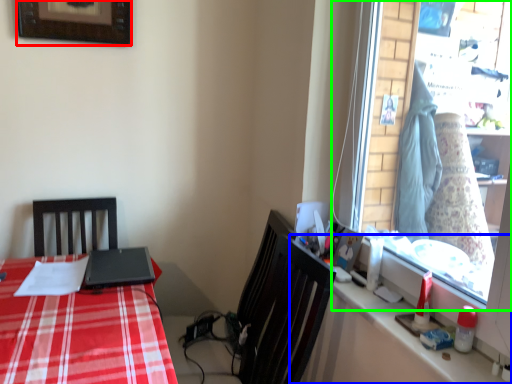
Question: Based on their relative distances, which object is farther from picture frame (highlighted by a red box)? Choose from counter top (highlighted by a blue box) and window (highlighted by a green box).

Choices:
 (A) counter top
 (B) window

Answer: (A)